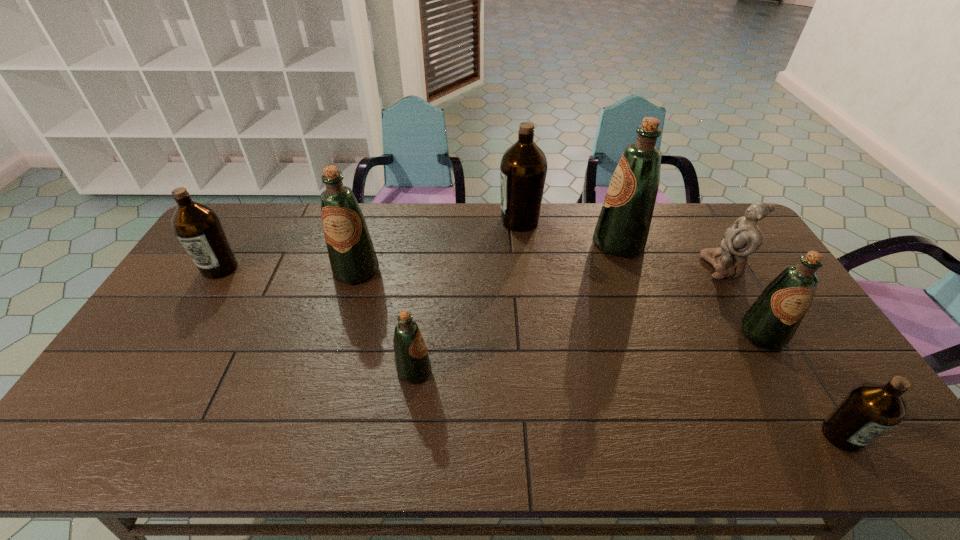
I want to click on vacant area located 0.370m on the label of the fourth olive oil from right to left, so click(398, 221).

Where is `vacant point located 0.250m on the front-facing side of the seventh object from right to left`? Image resolution: width=960 pixels, height=540 pixels. vacant point located 0.250m on the front-facing side of the seventh object from right to left is located at coordinates (332, 352).

The height and width of the screenshot is (540, 960). Identify the location of free space located on the label of the leftmost object. (183, 327).

The height and width of the screenshot is (540, 960). I want to click on vacant space located 0.160m on the front-facing side of the second smallest green olive oil, so click(x=804, y=405).

What are the coordinates of `vacant space situated 0.210m on the front-facing side of the white figurine` in the screenshot? It's located at (640, 267).

I want to click on free space located on the front-facing side of the white figurine, so click(640, 267).

At what (x,y) coordinates should I click in order to perform the action: click on free point located on the front-facing side of the white figurine. Please return your answer as a coordinate pair (x, y). The image size is (960, 540). Looking at the image, I should click on (689, 267).

Identify the location of blank space located on the front-facing side of the second nearest object. (571, 371).

Where is `object at the near edge`? The image size is (960, 540). object at the near edge is located at coordinates (870, 409).

This screenshot has height=540, width=960. Find the location of `object located in the left edge section of the desktop`. object located in the left edge section of the desktop is located at coordinates (197, 226).